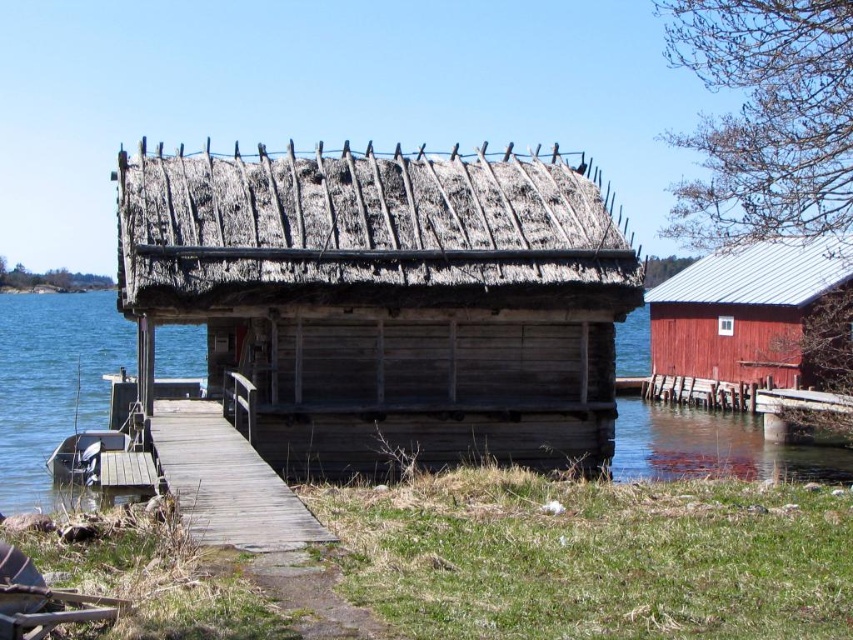
You are a painter who wants to paint both the wooden planks at center and the metallic gray boat at lower left. Which object requires more paint because it has a larger surface area?

The metallic gray boat at lower left requires more paint because it has a larger surface area than the wooden planks at center.

You are standing on the wooden walkway leading to the boathouse and want to reach the wooden thatched cabin at center. Which direction should you move relative to the wooden planks at center?

The wooden thatched cabin at center is to the left of the wooden planks at center, so you should move to the left of the wooden planks at center to reach it.

You are a painter who needs to decide which object to paint first. The wooden planks at center and the metallic gray boat at lower left are both in your view. Which object is shorter in height?

The wooden planks at center is shorter than the metallic gray boat at lower left.